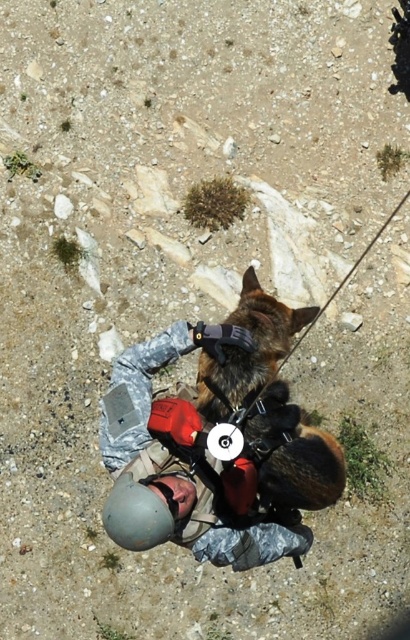
You are a safety inspector assessing the equipment setup in the scene. You notice the camouflage uniform at center and the gray matte helmet at lower center. Which piece of equipment is larger in size?

The camouflage uniform at center is bigger than the gray matte helmet at lower center.

You are a hiker planning to cross a narrow path. You have a backpack with a width of 30 cm. The path is only 50 cm wide. Can you safely carry both the camouflage uniform at center and the gray matte helmet at lower center in your backpack without exceeding the path width?

The camouflage uniform at center might be wider than gray matte helmet at lower center. Since the path is 50 cm wide and your backpack is 30 cm, the total width would be 30 cm plus the width of the items. However, without knowing the exact width of the camouflage uniform at center and gray matte helmet at lower center, it is uncertain if they will exceed the path width. You need to check their actual dimensions.